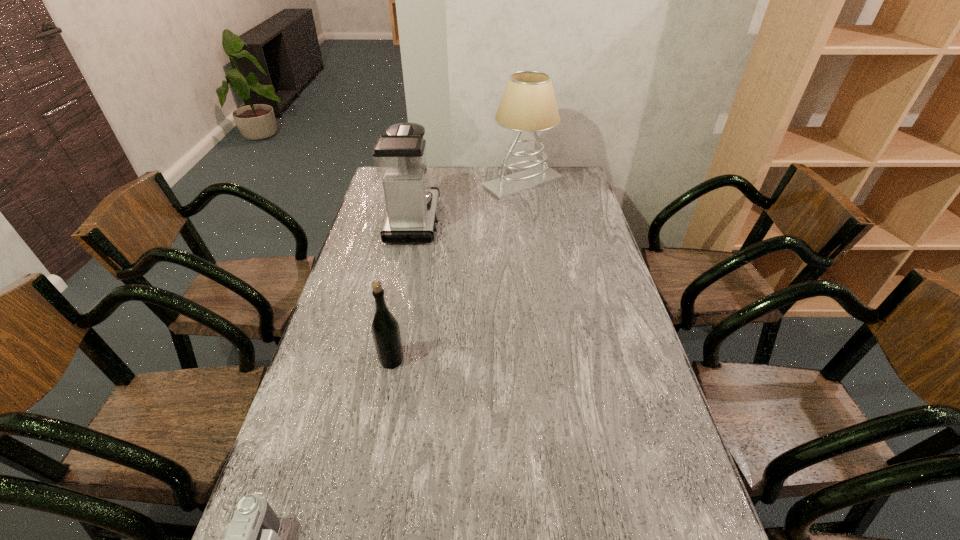
Image resolution: width=960 pixels, height=540 pixels. I want to click on the tallest object, so click(x=528, y=104).

Identify the location of the rightmost object. The image size is (960, 540). (528, 104).

You are a GUI agent. You are given a task and a screenshot of the screen. Output one action in this format:
    pyautogui.click(x=<x>, y=<y>)
    Task: Click on the second tallest object
    This screenshot has width=960, height=540.
    Given the screenshot: What is the action you would take?
    [x=399, y=156]

Locate an element on the screen. beer bottle is located at coordinates (385, 329).

Find the location of a particular element. Image resolution: width=960 pixels, height=540 pixels. the third farthest object is located at coordinates (385, 329).

Find the location of a particular element. Image resolution: width=960 pixels, height=540 pixels. free point located on the left of the table lamp is located at coordinates click(x=455, y=183).

The image size is (960, 540). In order to click on vacant space located at the front of the second tallest object where the controls are located in this screenshot , I will do `click(452, 221)`.

Find the location of a particular element. The height and width of the screenshot is (540, 960). free space located on the front of the second shortest object is located at coordinates (366, 496).

I want to click on object at the far edge, so click(528, 104).

The image size is (960, 540). In order to click on object positioned at the left edge in this screenshot , I will do `click(399, 156)`.